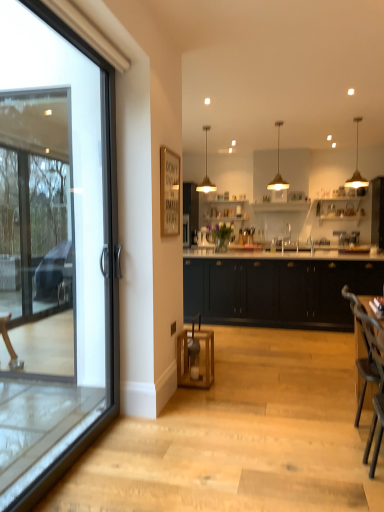
Question: Is black matte cabinetry at center situated inside wooden bar stool at center or outside?

Choices:
 (A) inside
 (B) outside

Answer: (B)

Question: In the image, is black matte cabinetry at center positioned in front of or behind wooden bar stool at center?

Choices:
 (A) front
 (B) behind

Answer: (B)

Question: Which object is the farthest from the gold metallic pendant light at upper right, positioned as the first lamp in right-to-left order?

Choices:
 (A) matte gold pendant light at upper center, which appears as the 2th lamp when viewed from the right
 (B) wooden armchair at right
 (C) wooden bar stool at center
 (D) gold metallic pendant light at upper center, which is the 1th lamp in left-to-right order
 (E) black matte cabinetry at center

Answer: (C)

Question: Which object is positioned closest to the black matte cabinetry at center?

Choices:
 (A) matte gold pendant light at upper center, which ranks as the second lamp in left-to-right order
 (B) wooden armchair at right
 (C) gold metallic pendant light at upper right, the third lamp in the left-to-right sequence
 (D) gold metallic pendant light at upper center, acting as the third lamp starting from the right
 (E) wooden bar stool at center

Answer: (B)